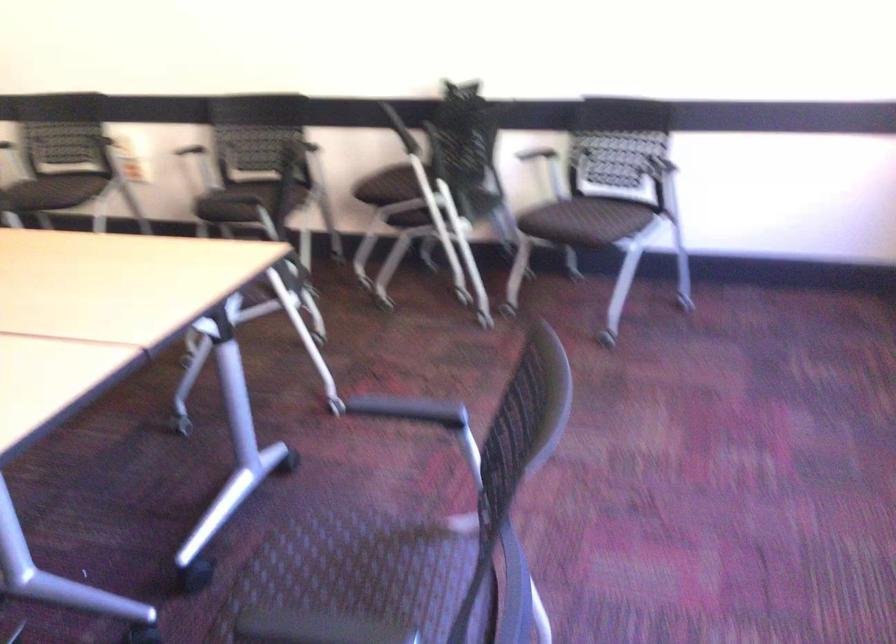
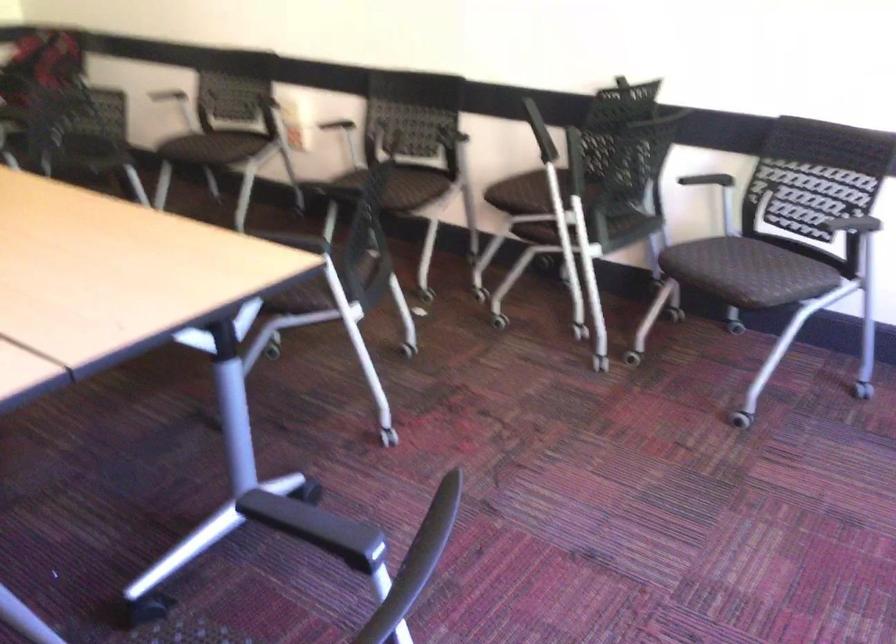
Where in the second image is the point corresponding to point (391, 412) from the first image?

(294, 518)